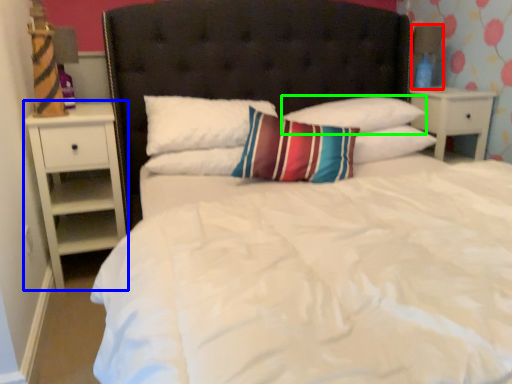
Question: Which object is positioned farthest from lamp (highlighted by a red box)? Select from nightstand (highlighted by a blue box) and pillow (highlighted by a green box).

Choices:
 (A) nightstand
 (B) pillow

Answer: (A)